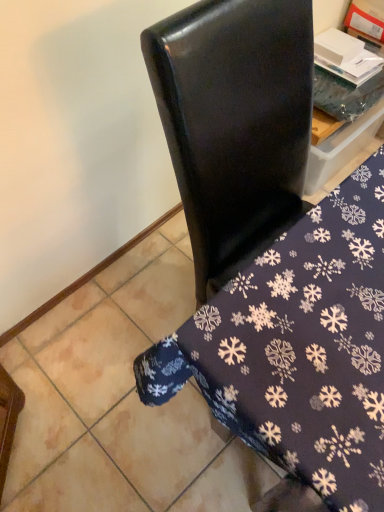
The height and width of the screenshot is (512, 384). Identify the location of glossy black chair at center. (271, 252).

Measure the distance between glossy black chair at center and camera.

glossy black chair at center is 24.12 inches from camera.

Describe the element at coordinates (271, 252) in the screenshot. I see `glossy black chair at center` at that location.

Where is `glossy black chair at center`? glossy black chair at center is located at coordinates (271, 252).